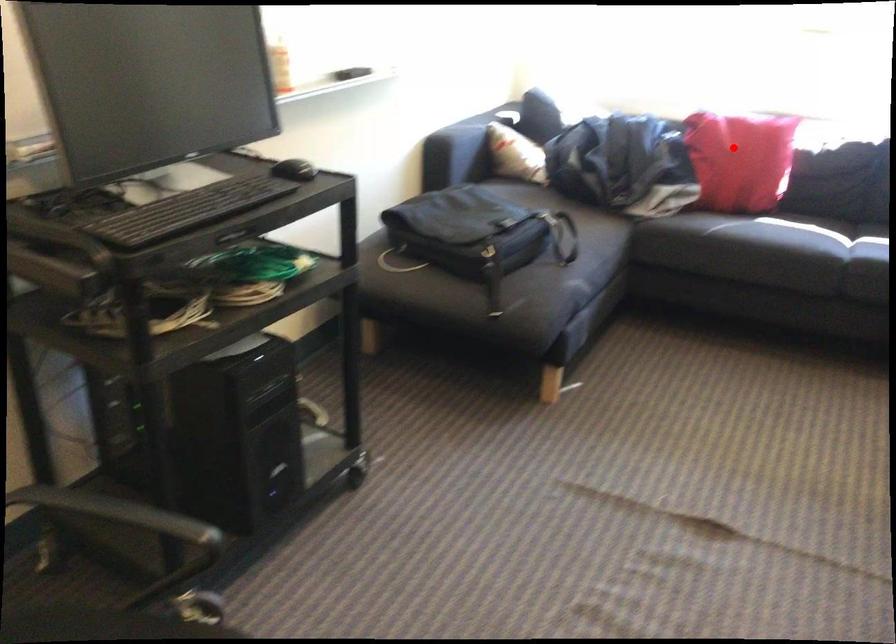
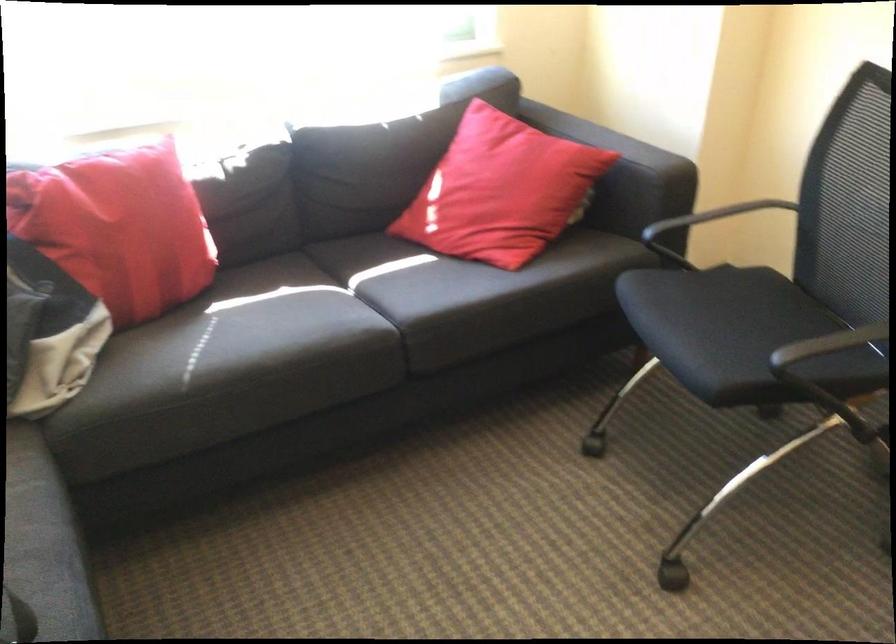
Question: I am providing you with two images of the same scene from different viewpoints. Given a red point in image1, look at the same physical point in image2. Is it:

Choices:
 (A) Closer to the viewpoint
 (B) Farther from the viewpoint

Answer: (A)